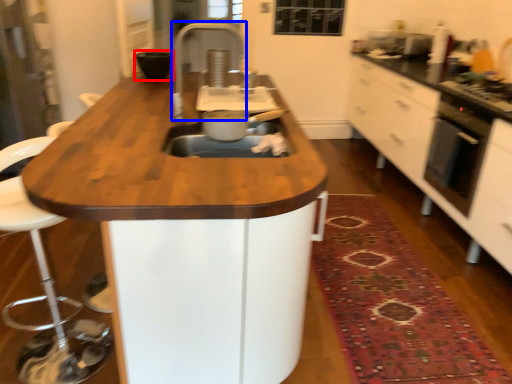
Question: Among these objects, which one is nearest to the camera, appliance (highlighted by a red box) or faucet (highlighted by a blue box)?

Choices:
 (A) appliance
 (B) faucet

Answer: (B)